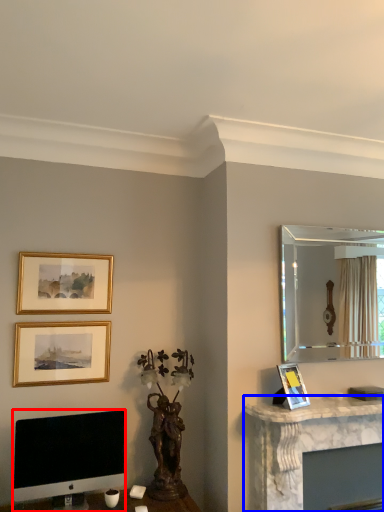
Question: Which point is further to the camera, computer monitor (highlighted by a red box) or computer desk (highlighted by a blue box)?

Choices:
 (A) computer monitor
 (B) computer desk

Answer: (B)